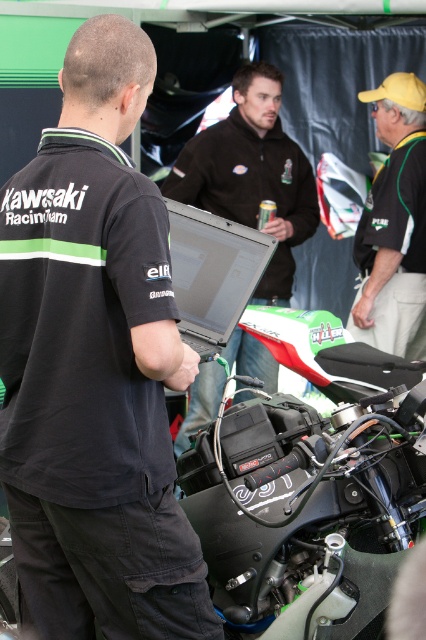
Question: Can you confirm if black fabric shirt at center is positioned to the left of black matte motorcycle at center?

Choices:
 (A) no
 (B) yes

Answer: (B)

Question: Which point appears closest to the camera in this image?

Choices:
 (A) (265, 116)
 (B) (388, 282)

Answer: (B)

Question: Can you confirm if yellow fabric cap at upper right is smaller than matte black laptop at center?

Choices:
 (A) yes
 (B) no

Answer: (B)

Question: Which object appears farthest from the camera in this image?

Choices:
 (A) black fabric shirt at center
 (B) yellow fabric cap at upper right
 (C) matte black laptop at center

Answer: (B)

Question: Does black matte motorcycle at center appear on the left side of dark brown leather jacket at center?

Choices:
 (A) yes
 (B) no

Answer: (B)

Question: Which object is positioned farthest from the matte black laptop at center?

Choices:
 (A) dark brown leather jacket at center
 (B) yellow fabric cap at upper right
 (C) black fabric shirt at center
 (D) black matte motorcycle at center

Answer: (A)